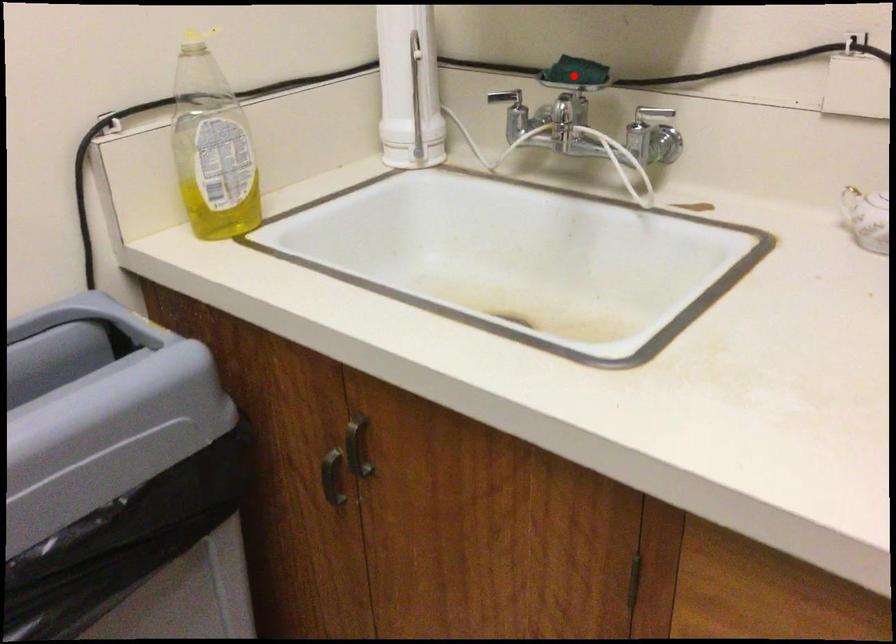
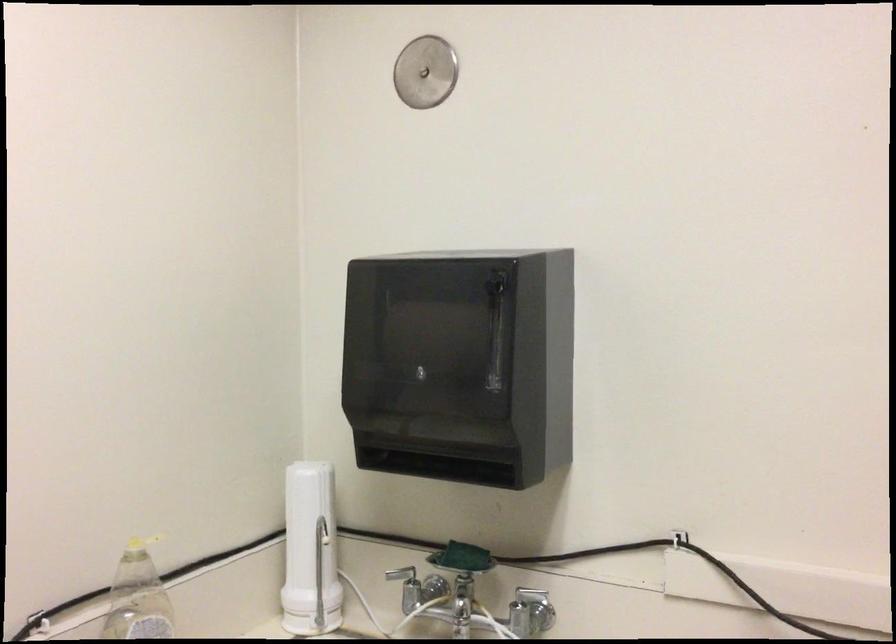
In the second image, find the point that corresponds to the highlighted location in the first image.

(462, 558)